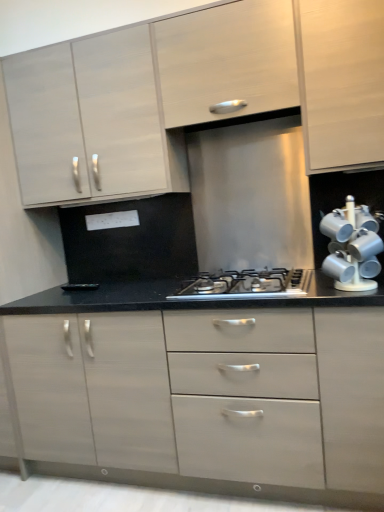
Question: Considering the relative positions of matte white cabinet at upper left, which appears as the second cabinetry when viewed from the top, and white glossy mug rack at right in the image provided, is matte white cabinet at upper left, which appears as the second cabinetry when viewed from the top, to the right of white glossy mug rack at right from the viewer's perspective?

Choices:
 (A) no
 (B) yes

Answer: (A)

Question: Considering the relative sizes of matte white cabinet at upper left, acting as the second cabinetry starting from the bottom, and white glossy mug rack at right in the image provided, is matte white cabinet at upper left, acting as the second cabinetry starting from the bottom, bigger than white glossy mug rack at right?

Choices:
 (A) yes
 (B) no

Answer: (A)

Question: Does matte white cabinet at upper left, which appears as the second cabinetry when viewed from the top, have a smaller size compared to white glossy mug rack at right?

Choices:
 (A) no
 (B) yes

Answer: (A)

Question: Is matte white cabinet at upper left, acting as the second cabinetry starting from the bottom, positioned far away from white glossy mug rack at right?

Choices:
 (A) no
 (B) yes

Answer: (B)

Question: Is matte white cabinet at upper left, which appears as the second cabinetry when viewed from the top, located outside white glossy mug rack at right?

Choices:
 (A) yes
 (B) no

Answer: (A)

Question: From the image's perspective, is matte white cabinet at upper left, which appears as the second cabinetry when viewed from the top, above white glossy mug rack at right?

Choices:
 (A) yes
 (B) no

Answer: (A)

Question: Is satin silver gas stove at center thinner than matte white drawer at center, the 3th cabinetry from the top?

Choices:
 (A) yes
 (B) no

Answer: (A)

Question: Would you say matte white drawer at center, the first cabinetry from the bottom, is part of satin silver gas stove at center's contents?

Choices:
 (A) yes
 (B) no

Answer: (B)

Question: From a real-world perspective, is satin silver gas stove at center beneath matte white drawer at center, the 3th cabinetry from the top?

Choices:
 (A) no
 (B) yes

Answer: (A)

Question: Does satin silver gas stove at center have a lesser height compared to matte white drawer at center, the 3th cabinetry from the top?

Choices:
 (A) no
 (B) yes

Answer: (B)

Question: Can you confirm if satin silver gas stove at center is positioned to the right of matte white drawer at center, the 3th cabinetry from the top?

Choices:
 (A) yes
 (B) no

Answer: (A)

Question: Could you tell me if satin silver gas stove at center is facing matte white drawer at center, the first cabinetry from the bottom?

Choices:
 (A) yes
 (B) no

Answer: (B)

Question: From the image's perspective, is matte white cabinet at upper center, the third cabinetry when ordered from bottom to top, below white glossy mug rack at right?

Choices:
 (A) no
 (B) yes

Answer: (A)